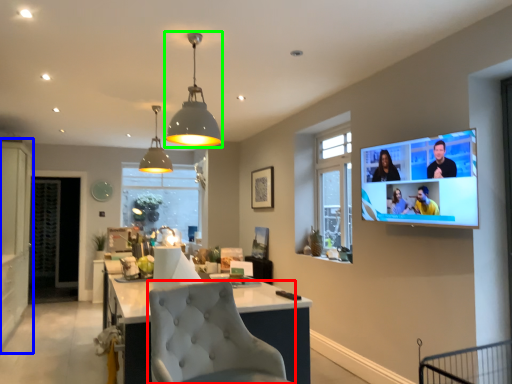
Question: Which object is the farthest from chair (highlighted by a red box)? Choose among these: cabinetry (highlighted by a blue box) or light fixture (highlighted by a green box).

Choices:
 (A) cabinetry
 (B) light fixture

Answer: (A)